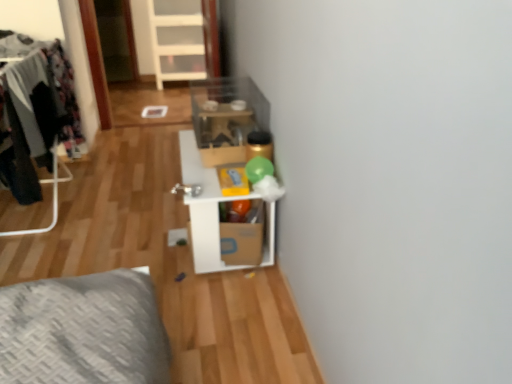
In order to click on vacant space situated on the left part of white cardboard shelf at center in this screenshot , I will do `click(127, 226)`.